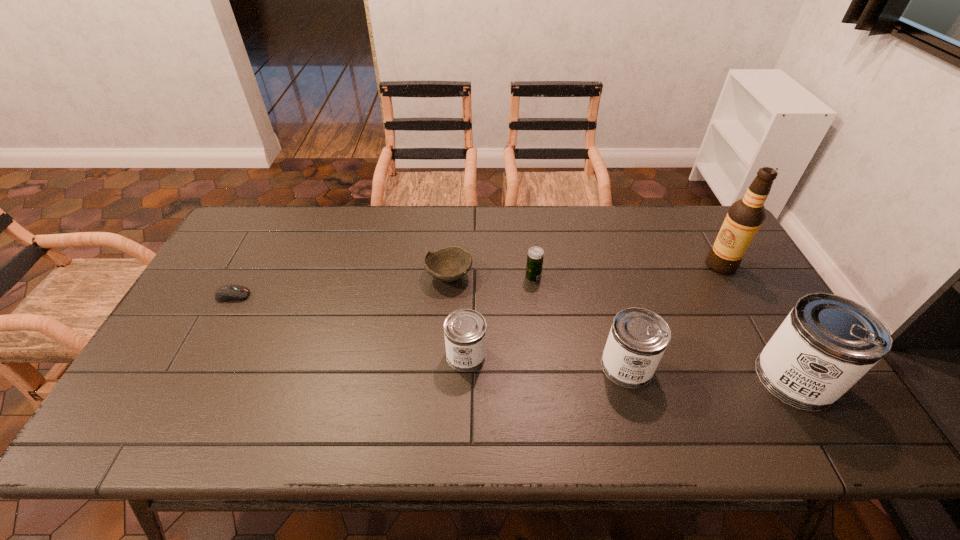
Considering the uniform spacing of cans, where should an additional can be positioned on the left? Please locate a free spot. Please provide its 2D coordinates. Your answer should be formatted as a tuple, i.e. [(x, y)], where the tuple contains the x and y coordinates of a point satisfying the conditions above.

[(312, 344)]